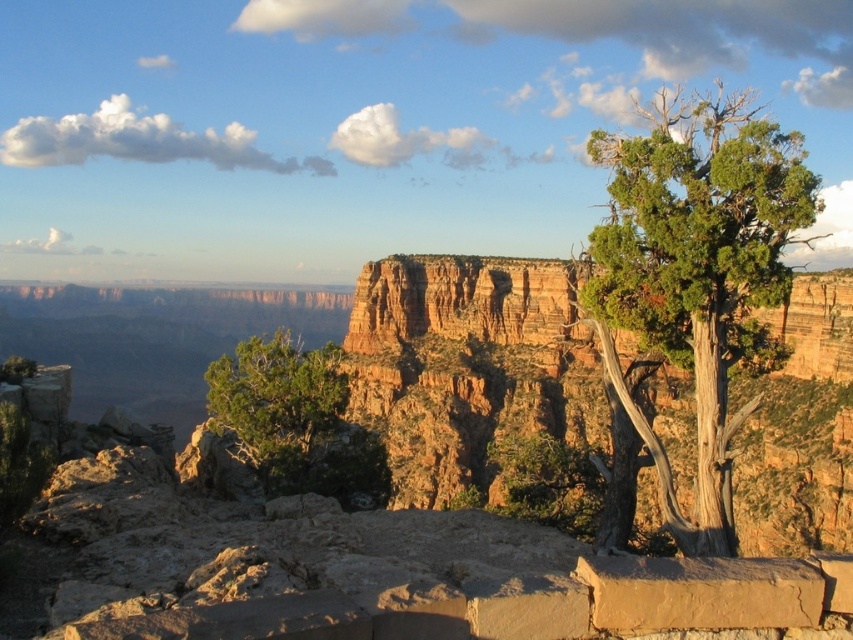
You are a hiker standing at the edge of the canyon and see the green textured tree at upper right and the green rough textured bush at lower left. Which one is closer to you?

The green textured tree at upper right is closer to you because it is in front of the green rough textured bush at lower left.

You are standing at the canyon edge and see two points marked on the canyon wall. The first point is at coordinates point (x=601, y=314) and the second is at point (x=241, y=413). Which point is physically closer to you as you stand at the edge?

Point (x=601, y=314) is closer to the viewer than point (x=241, y=413), so the first point is closer to you as you stand at the edge.